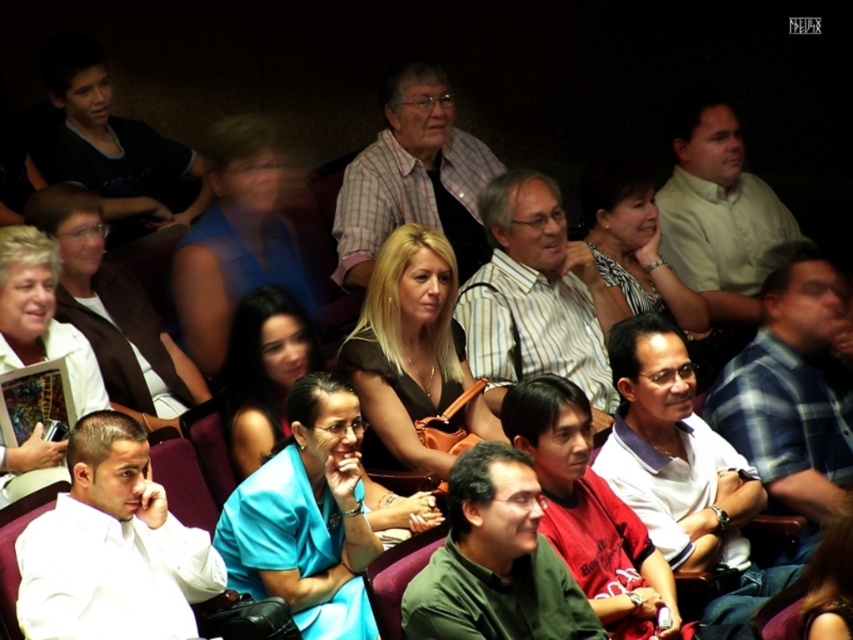
Question: Which object is farther from the camera taking this photo?

Choices:
 (A) white paper at center
 (B) brown matte dress at center

Answer: (B)

Question: Which point is closer to the camera?

Choices:
 (A) (547, 266)
 (B) (363, 243)
 (C) (726, 500)
 (D) (180, 374)

Answer: (C)

Question: Can you confirm if light brown shirt at center is smaller than white paper at center?

Choices:
 (A) no
 (B) yes

Answer: (A)

Question: Does blue plaid shirt at right have a greater width compared to matte white jacket at center-left?

Choices:
 (A) no
 (B) yes

Answer: (A)

Question: Among these objects, which one is nearest to the camera?

Choices:
 (A) blue fabric dress at center
 (B) white paper at center

Answer: (B)

Question: Does white shirt at left have a smaller size compared to brown matte dress at center?

Choices:
 (A) no
 (B) yes

Answer: (B)